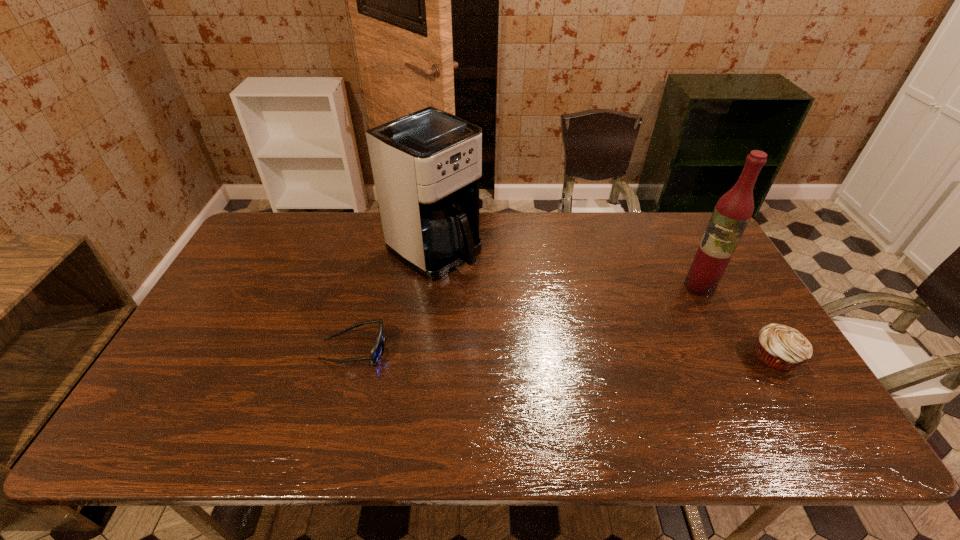
The height and width of the screenshot is (540, 960). In order to click on free spot on the desktop that is between the shortest object and the muffin and is positioned on the front panel of the coffee maker in this screenshot , I will do `click(592, 354)`.

This screenshot has width=960, height=540. Find the location of `free space on the desktop that is between the sunglasses and the second shortest object and is positioned on the label of the liquor`. free space on the desktop that is between the sunglasses and the second shortest object and is positioned on the label of the liquor is located at coordinates (598, 354).